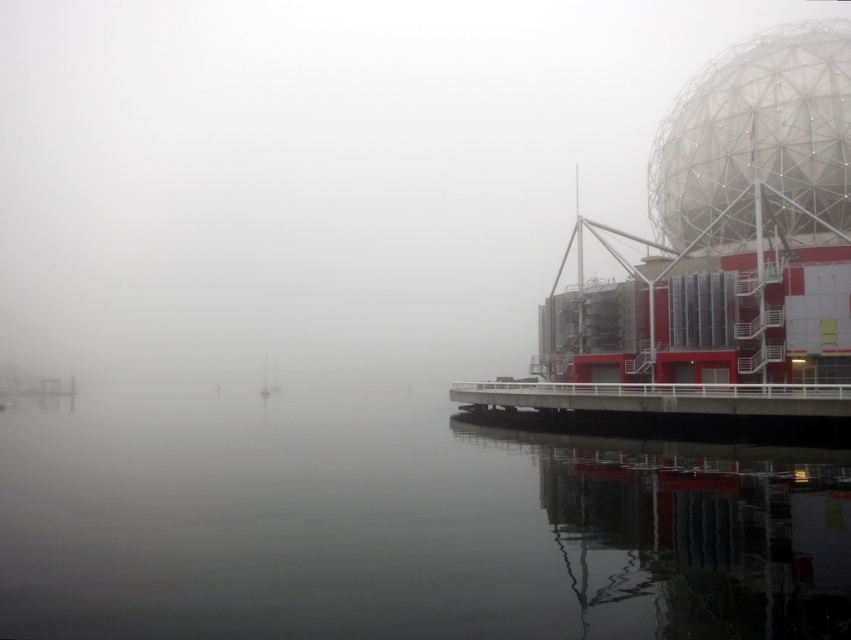
From the picture: You are standing on the walkway near the modern building with the geodesic dome. You want to get to the white metal dock at lower right. What should you do to avoid stepping into the smooth water at center?

The smooth water at center is much taller than the white metal dock at lower right. To avoid stepping into the smooth water at center, you should move towards the white metal dock at lower right since it is lower and closer to the ground level.

You are standing on the walkway near the modern building with the geodesic dome. You want to find the smooth water at center. According to the coordinates provided, in which direction should you look relative to the building?

The smooth water at center is located at coordinates point (398, 524). Since the x coordinate is 0.819, which is closer to the right edge of the image, you should look towards the right side of the building to find the smooth water at center.